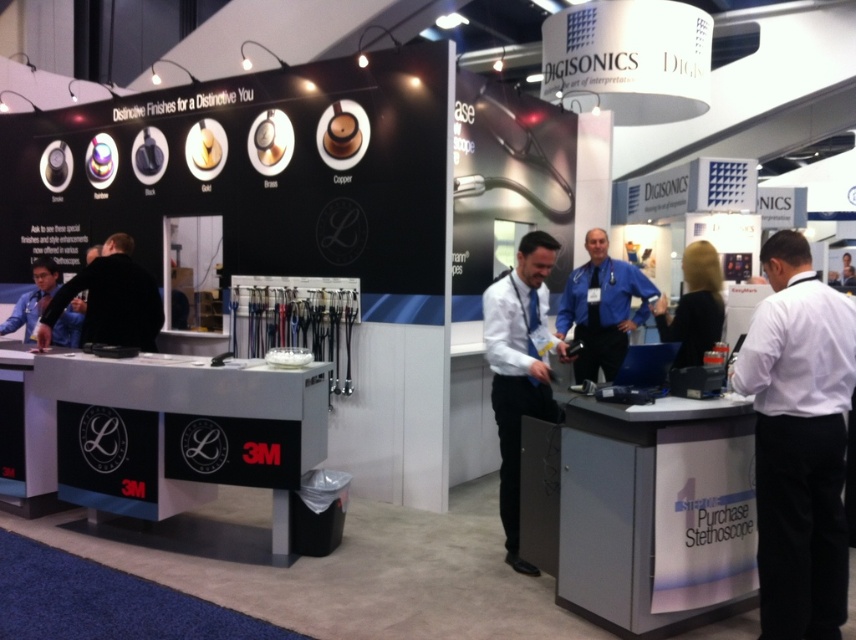
You are attending a trade show and notice the Digisonics booth. You see a blue uniform at center. Where is the blue uniform located in relation to the stethoscope display on the left?

The blue uniform at center is located at point (602,308), which is near the center of the booth, while the stethoscope display on the left is positioned to the left side. Therefore, the blue uniform at center is to the right of the stethoscope display on the left.

You are an attendee at the Digisonics trade show booth. You see a white shirt at right and a blue uniform at center. Which clothing item is positioned lower in the image?

The white shirt at right is located below the blue uniform at center, so it is positioned lower in the image.

You are a photographer at the Digisonics booth and need to capture a photo that includes both the white shirt at right and the blue uniform at center. Which of the two should you focus on first if you want to ensure both are in frame without moving the camera?

The white shirt at right is taller than the blue uniform at center. Since the white shirt at right is taller, you should focus on it first to ensure the entire height of both subjects fits within the frame.